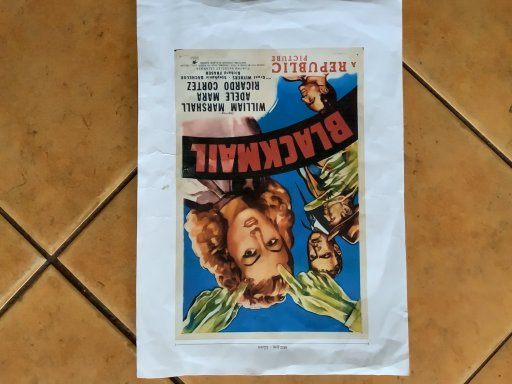
The width and height of the screenshot is (512, 384). What are the coordinates of `vacant area on top of matte paper poster at center (from a real-world perspective)` in the screenshot? It's located at (282, 182).